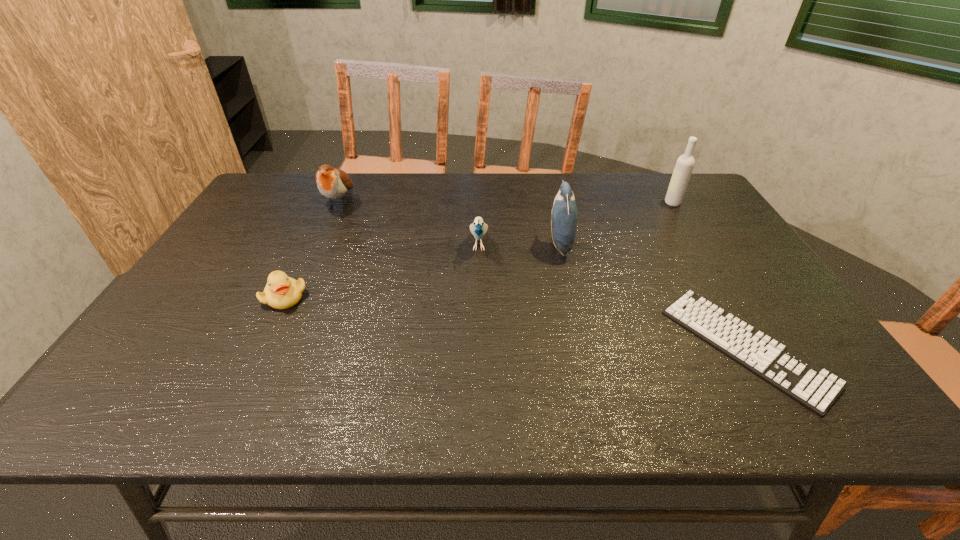
Identify the location of bird that is the second nearest to the leftmost bird. This screenshot has width=960, height=540. [564, 212].

Identify which bird is the third nearest to the duckling. Please provide its 2D coordinates. Your answer should be formatted as a tuple, i.e. [(x, y)], where the tuple contains the x and y coordinates of a point satisfying the conditions above.

[(564, 212)]

Identify the location of free spot that satisfies the following two spatial constraints: 1. at the face of the shortest object; 2. on the left side of the second bird from right to left. The image size is (960, 540). (478, 347).

At what (x,y) coordinates should I click in order to perform the action: click on vacant region that satisfies the following two spatial constraints: 1. at the face of the computer keyboard; 2. on the left side of the leftmost bird. Please return your answer as a coordinate pair (x, y). Image resolution: width=960 pixels, height=540 pixels. Looking at the image, I should click on (275, 347).

Identify the location of free space that satisfies the following two spatial constraints: 1. at the tip of the rightmost bird's beak; 2. on the back side of the shortest object. The height and width of the screenshot is (540, 960). (583, 347).

I want to click on vacant space that satisfies the following two spatial constraints: 1. at the face of the shortest object; 2. on the left side of the second bird from right to left, so click(478, 347).